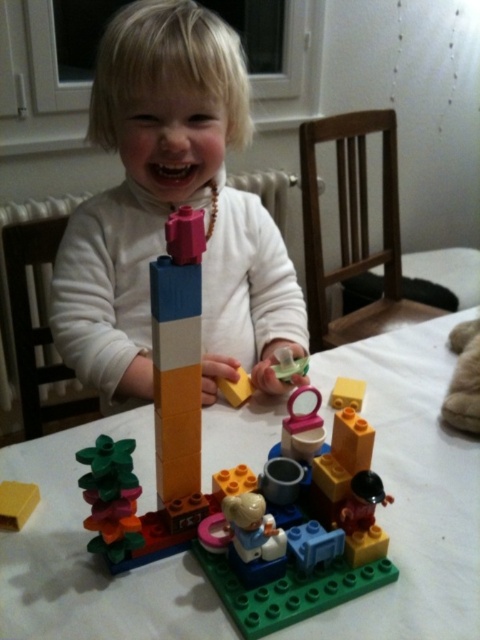
In the scene shown: You are a parent standing at the edge of the table where your child is building a LEGO tower. The multicolored plastic tower at center is the one your child is currently working on. If you want to hand them a new LEGO piece from your hand, which is currently 20 inches away from the tower, will you need to move closer to reach it?

The multicolored plastic tower at center is 19.22 inches away from viewer. Since your hand is 20 inches away from the tower, you are slightly farther than the tower. To reach the tower, you need to move closer by approximately 0.78 inches so that your hand can reach the multicolored plastic tower at center.

You are a parent trying to organize the playroom. You have the white plastic table at center and the smooth plastic lego set at center. Which object should you move to the left to make space for a new toy shelf?

You should move the white plastic table at center to the left because it is currently on the right side of the smooth plastic lego set at center, so moving it left would create space on the right for the new toy shelf.